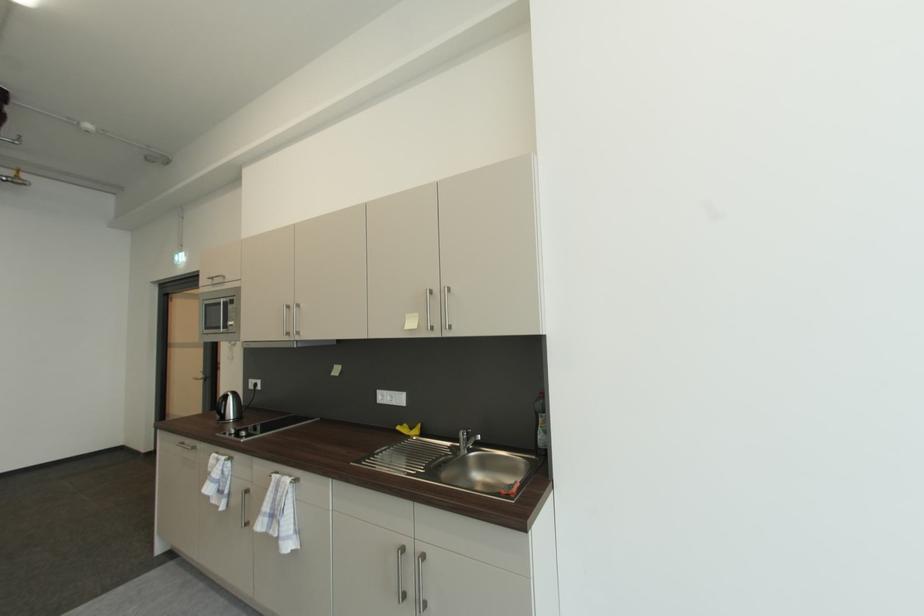
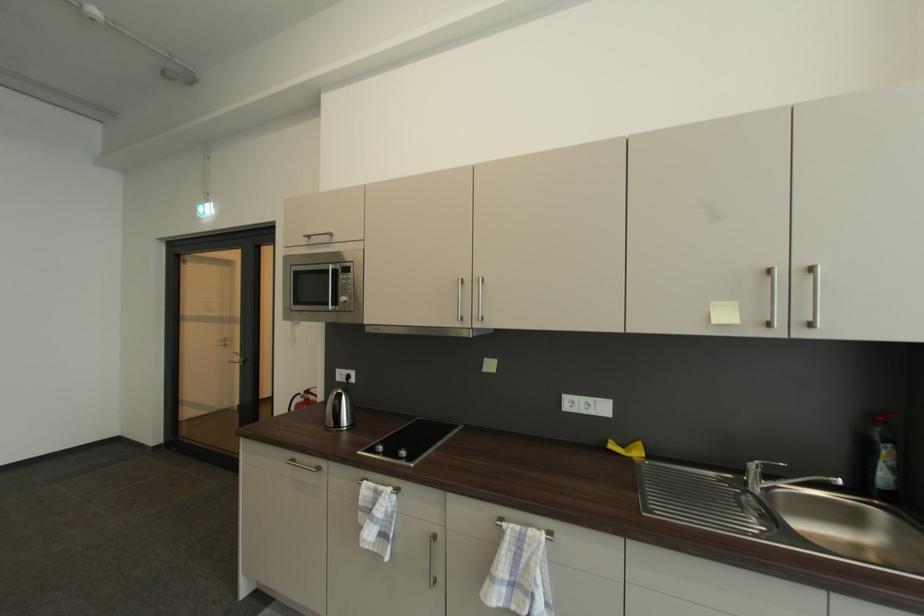
What movement of the cameraman would produce the second image?

The movement direction of the cameraman is left, forward.